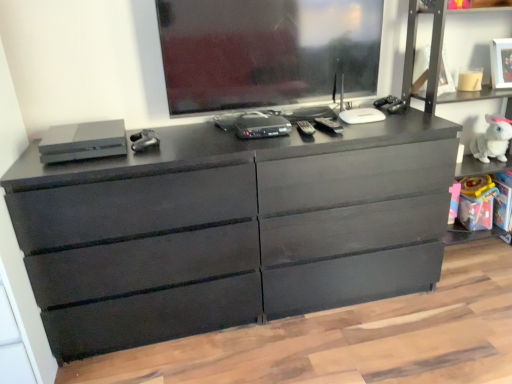
At what (x,y) coordinates should I click in order to perform the action: click on vacant region in front of matte black controller at center, marked as the 2th equipment in a left-to-right arrangement. Please return your answer as a coordinate pair (x, y). This screenshot has width=512, height=384. Looking at the image, I should click on (133, 158).